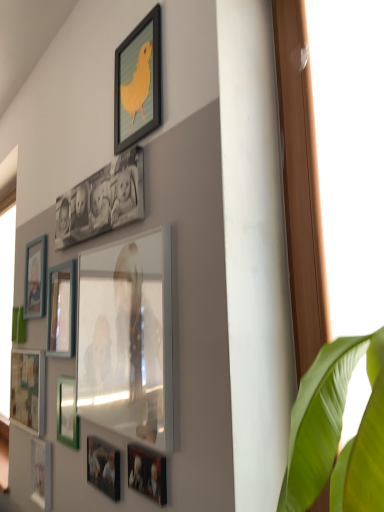
Question: Looking at their shapes, would you say matte black picture frame at lower center, the tenth picture frame in the top-to-bottom sequence, is wider or thinner than matte white picture frame at lower left, acting as the 9th picture frame starting from the top?

Choices:
 (A) thin
 (B) wide

Answer: (A)

Question: Relative to matte white picture frame at lower left, acting as the 9th picture frame starting from the top, is matte black picture frame at lower center, which is the 2th picture frame from bottom to top, in front or behind?

Choices:
 (A) behind
 (B) front

Answer: (B)

Question: Based on their relative distances, which object is farther from the matte wooden picture frame at left, which appears as the third picture frame when viewed from the top?

Choices:
 (A) green matte picture frame at lower left, the sixth picture frame from the top
 (B) matte black picture frame at upper center, which is the eleventh picture frame from bottom to top
 (C) matte black photo frame at upper center, which is the tenth picture frame from bottom to top
 (D) green matte picture frame at lower left, which is the eighth picture frame in top-to-bottom order
 (E) matte glass picture frame at center, which is counted as the seventh picture frame, starting from the bottom

Answer: (B)

Question: Which of these objects is positioned closest to the matte black picture frame at upper center, the first picture frame viewed from the top?

Choices:
 (A) wooden photo frame at left, the eighth picture frame positioned from the bottom
 (B) matte white picture frame at lower left, which ranks as the first picture frame in bottom-to-top order
 (C) green matte picture frame at lower left, which is the eighth picture frame in top-to-bottom order
 (D) matte black photo frame at upper center, which is the tenth picture frame from bottom to top
 (E) green matte picture frame at lower left, the sixth picture frame from the top

Answer: (D)